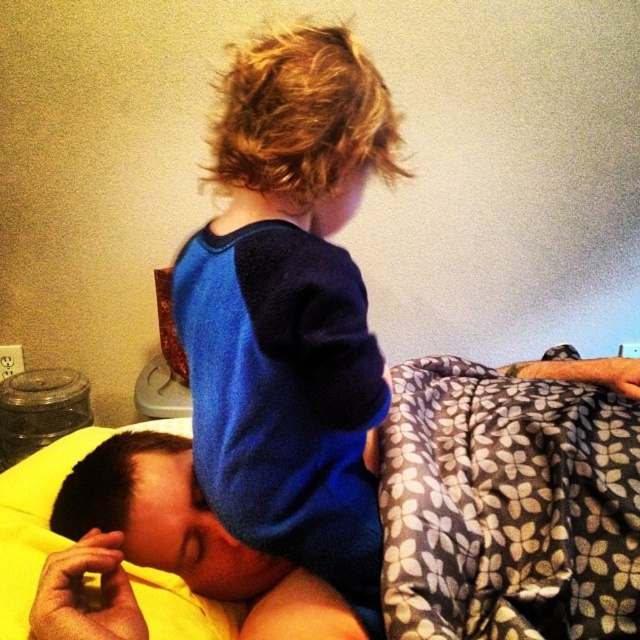
Looking at this image, does blue soft fabric toddler at upper center have a larger size compared to floral-patterned fleece blanket at upper right?

Yes.

Does blue soft fabric toddler at upper center lie in front of floral-patterned fleece blanket at upper right?

Yes.

Identify the location of blue soft fabric toddler at upper center. (291, 310).

Image resolution: width=640 pixels, height=640 pixels. I want to click on blue soft fabric toddler at upper center, so click(x=291, y=310).

Which is more to the right, blue soft fabric toddler at upper center or yellow soft pillow at lower left?

blue soft fabric toddler at upper center

Is blue soft fabric toddler at upper center thinner than yellow soft pillow at lower left?

Correct, blue soft fabric toddler at upper center's width is less than yellow soft pillow at lower left's.

You are a GUI agent. You are given a task and a screenshot of the screen. Output one action in this format:
    pyautogui.click(x=<x>, y=<y>)
    Task: Click on the blue soft fabric toddler at upper center
    
    Given the screenshot: What is the action you would take?
    pyautogui.click(x=291, y=310)

Locate an element on the screen. The image size is (640, 640). blue soft fabric toddler at upper center is located at coordinates (291, 310).

From the picture: Who is shorter, floral-patterned fabric at upper center or yellow soft pillow at lower left?

yellow soft pillow at lower left is shorter.

Between floral-patterned fabric at upper center and yellow soft pillow at lower left, which one is positioned lower?

Positioned lower is yellow soft pillow at lower left.

Which is in front, point (502, 435) or point (88, 520)?

Point (88, 520) is in front.

This screenshot has height=640, width=640. I want to click on floral-patterned fabric at upper center, so click(x=512, y=499).